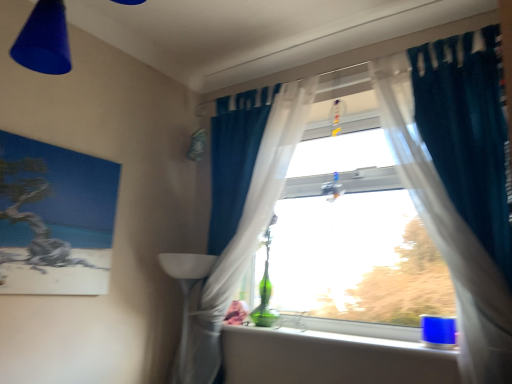
In order to face matte plastic cone at upper left, should I rotate leftwards or rightwards?

Rotate your view left by about 23.413°.

Where is `translucent fabric curtain at center, the 1th curtain in the left-to-right sequence`? translucent fabric curtain at center, the 1th curtain in the left-to-right sequence is located at coordinates (241, 236).

From a real-world perspective, between translucent fabric curtain at center, the 1th curtain in the left-to-right sequence, and matte canvas painting at left, who is vertically lower?

From a 3D spatial view, matte canvas painting at left is below.

Consider the image. Does translucent fabric curtain at center, the second curtain from the right, come behind matte canvas painting at left?

Yes, translucent fabric curtain at center, the second curtain from the right, is behind matte canvas painting at left.

The height and width of the screenshot is (384, 512). I want to click on light fixture located in front of the matte canvas painting at left, so click(44, 40).

Can you confirm if matte canvas painting at left is smaller than matte plastic cone at upper left?

Correct, matte canvas painting at left occupies less space than matte plastic cone at upper left.

Is matte canvas painting at left not inside matte plastic cone at upper left?

Indeed, matte canvas painting at left is completely outside matte plastic cone at upper left.

Does matte canvas painting at left turn towards matte plastic cone at upper left?

Yes, matte canvas painting at left faces towards matte plastic cone at upper left.

From the image's perspective, is translucent fabric curtain at center, the 1th curtain in the left-to-right sequence, positioned above or below matte plastic cone at upper left?

translucent fabric curtain at center, the 1th curtain in the left-to-right sequence, is below matte plastic cone at upper left.

Is translucent fabric curtain at center, the second curtain from the right, placed right next to matte plastic cone at upper left?

No, translucent fabric curtain at center, the second curtain from the right, is not touching matte plastic cone at upper left.

Does translucent fabric curtain at center, the 1th curtain in the left-to-right sequence, appear on the left side of matte plastic cone at upper left?

No.

Considering the relative positions of matte canvas painting at left and blue plastic cup at lower right in the image provided, is matte canvas painting at left to the left or to the right of blue plastic cup at lower right?

Clearly, matte canvas painting at left is on the left of blue plastic cup at lower right in the image.

Is matte canvas painting at left placed right next to blue plastic cup at lower right?

No, matte canvas painting at left is not beside blue plastic cup at lower right.

At what (x,y) coordinates should I click in order to perform the action: click on window sill that appears behind the matte canvas painting at left. Please return your answer as a coordinate pair (x, y). Looking at the image, I should click on (345, 332).

Which point is more distant from viewer, (99, 288) or (354, 326)?

The point (354, 326) is behind.

Would you consider translucent fabric curtain at center, the 1th curtain in the left-to-right sequence, to be distant from blue plastic cup at lower right?

No, translucent fabric curtain at center, the 1th curtain in the left-to-right sequence, is not far away from blue plastic cup at lower right.

Could you tell me if translucent fabric curtain at center, the 1th curtain in the left-to-right sequence, is turned towards blue plastic cup at lower right?

No, translucent fabric curtain at center, the 1th curtain in the left-to-right sequence, is not aimed at blue plastic cup at lower right.

This screenshot has width=512, height=384. In order to click on curtain behind the blue plastic cup at lower right in this screenshot , I will do `click(241, 236)`.

Is matte canvas painting at left next to teal fabric curtain at upper right, marked as the first curtain in a right-to-left arrangement?

No, matte canvas painting at left is not with teal fabric curtain at upper right, marked as the first curtain in a right-to-left arrangement.

Which is correct: matte canvas painting at left is inside teal fabric curtain at upper right, marked as the first curtain in a right-to-left arrangement, or outside of it?

matte canvas painting at left is outside teal fabric curtain at upper right, marked as the first curtain in a right-to-left arrangement.

Between point (108, 203) and point (475, 242), which one is positioned behind?

The point (108, 203) is more distant.

Which object is positioned more to the right, matte canvas painting at left or teal fabric curtain at upper right, marked as the second curtain in a left-to-right arrangement?

From the viewer's perspective, teal fabric curtain at upper right, marked as the second curtain in a left-to-right arrangement, appears more on the right side.

Based on their sizes in the image, would you say matte plastic cone at upper left is bigger or smaller than blue plastic cup at lower right?

Considering their sizes, matte plastic cone at upper left takes up more space than blue plastic cup at lower right.

You are a GUI agent. You are given a task and a screenshot of the screen. Output one action in this format:
    pyautogui.click(x=<x>, y=<y>)
    Task: Click on the window sill below the matte plastic cone at upper left (from a real-world perspective)
    This screenshot has width=512, height=384.
    Given the screenshot: What is the action you would take?
    pyautogui.click(x=345, y=332)

Consider the image. How distant is matte plastic cone at upper left from blue plastic cup at lower right?

1.41 meters.

Is matte plastic cone at upper left aimed at blue plastic cup at lower right?

No, matte plastic cone at upper left is not facing towards blue plastic cup at lower right.

Locate an element on the screen. This screenshot has width=512, height=384. curtain below the matte canvas painting at left (from the image's perspective) is located at coordinates (241, 236).

Image resolution: width=512 pixels, height=384 pixels. I want to click on light fixture above the matte canvas painting at left (from the image's perspective), so click(44, 40).

When comparing their distances from matte plastic cone at upper left, does teal fabric curtain at upper right, marked as the second curtain in a left-to-right arrangement, or matte canvas painting at left seem closer?

Based on the image, matte canvas painting at left appears to be nearer to matte plastic cone at upper left.

Considering their positions, is matte plastic cone at upper left positioned closer to teal fabric curtain at upper right, marked as the second curtain in a left-to-right arrangement, than translucent fabric curtain at center, the second curtain from the right?

translucent fabric curtain at center, the second curtain from the right, is positioned closer to the anchor teal fabric curtain at upper right, marked as the second curtain in a left-to-right arrangement.

From the image, which object appears to be farther from blue plastic cup at lower right, matte canvas painting at left or teal fabric curtain at upper right, marked as the first curtain in a right-to-left arrangement?

matte canvas painting at left is further to blue plastic cup at lower right.

Based on their spatial positions, is teal fabric curtain at upper right, marked as the first curtain in a right-to-left arrangement, or blue plastic cup at lower right further from matte canvas painting at left?

The object further to matte canvas painting at left is teal fabric curtain at upper right, marked as the first curtain in a right-to-left arrangement.

Estimate the real-world distances between objects in this image. Which object is further from matte plastic cone at upper left, blue plastic cup at lower right or translucent fabric curtain at center, the second curtain from the right?

blue plastic cup at lower right is positioned further to the anchor matte plastic cone at upper left.

Estimate the real-world distances between objects in this image. Which object is further from teal fabric curtain at upper right, marked as the first curtain in a right-to-left arrangement, matte plastic cone at upper left or matte canvas painting at left?

matte canvas painting at left is further to teal fabric curtain at upper right, marked as the first curtain in a right-to-left arrangement.

Which object lies further to the anchor point translucent fabric curtain at center, the second curtain from the right, blue plastic cup at lower right or matte plastic cone at upper left?

matte plastic cone at upper left is further to translucent fabric curtain at center, the second curtain from the right.

When comparing their distances from translucent fabric curtain at center, the 1th curtain in the left-to-right sequence, does blue plastic cup at lower right or teal fabric curtain at upper right, marked as the second curtain in a left-to-right arrangement, seem closer?

blue plastic cup at lower right is positioned closer to the anchor translucent fabric curtain at center, the 1th curtain in the left-to-right sequence.

Image resolution: width=512 pixels, height=384 pixels. What are the coordinates of `window sill between matte plastic cone at upper left and translucent fabric curtain at center, the second curtain from the right, along the z-axis` in the screenshot? It's located at (345, 332).

Where is `picture frame between matte plastic cone at upper left and translucent fabric curtain at center, the 1th curtain in the left-to-right sequence, from front to back`? This screenshot has width=512, height=384. picture frame between matte plastic cone at upper left and translucent fabric curtain at center, the 1th curtain in the left-to-right sequence, from front to back is located at coordinates (55, 219).

Identify the location of window sill situated between translucent fabric curtain at center, the second curtain from the right, and teal fabric curtain at upper right, marked as the first curtain in a right-to-left arrangement, from left to right. (345, 332).

Locate an element on the screen. light fixture between matte canvas painting at left and blue plastic cup at lower right is located at coordinates (44, 40).